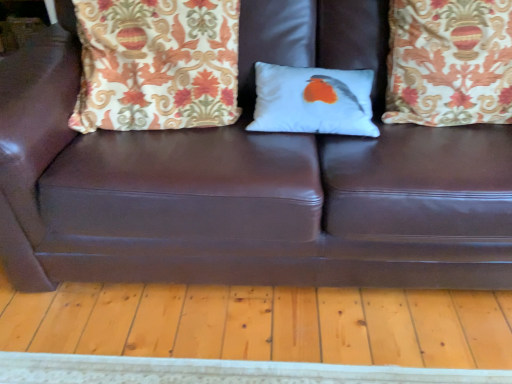
Question: Does patterned fabric pillow at upper left, placed as the 1th pillow when sorted from left to right, have a greater width compared to patterned fabric pillow at upper right, the first pillow when ordered from right to left?

Choices:
 (A) no
 (B) yes

Answer: (B)

Question: Is patterned fabric pillow at upper left, the third pillow positioned from the right, smaller than patterned fabric pillow at upper right, which appears as the third pillow when viewed from the left?

Choices:
 (A) yes
 (B) no

Answer: (B)

Question: Is patterned fabric pillow at upper left, placed as the 1th pillow when sorted from left to right, positioned behind patterned fabric pillow at upper right, which appears as the third pillow when viewed from the left?

Choices:
 (A) yes
 (B) no

Answer: (B)

Question: Would you say patterned fabric pillow at upper left, the third pillow positioned from the right, is a long distance from patterned fabric pillow at upper right, which appears as the third pillow when viewed from the left?

Choices:
 (A) no
 (B) yes

Answer: (A)

Question: Is patterned fabric pillow at upper left, placed as the 1th pillow when sorted from left to right, with patterned fabric pillow at upper right, the first pillow when ordered from right to left?

Choices:
 (A) no
 (B) yes

Answer: (A)

Question: From their relative heights in the image, would you say white matte pillow with bird design at center, which is the second pillow from right to left, is taller or shorter than patterned fabric pillow at upper left, the third pillow positioned from the right?

Choices:
 (A) short
 (B) tall

Answer: (A)

Question: In the image, is white matte pillow with bird design at center, which is the second pillow from right to left, positioned in front of or behind patterned fabric pillow at upper left, the third pillow positioned from the right?

Choices:
 (A) front
 (B) behind

Answer: (B)

Question: Visually, is white matte pillow with bird design at center, the 2th pillow positioned from the left, positioned to the left or to the right of patterned fabric pillow at upper left, placed as the 1th pillow when sorted from left to right?

Choices:
 (A) left
 (B) right

Answer: (B)

Question: From a real-world perspective, relative to patterned fabric pillow at upper left, placed as the 1th pillow when sorted from left to right, is white matte pillow with bird design at center, the 2th pillow positioned from the left, vertically above or below?

Choices:
 (A) below
 (B) above

Answer: (A)

Question: Is white matte pillow with bird design at center, which is the second pillow from right to left, wider or thinner than patterned fabric pillow at upper right, the first pillow when ordered from right to left?

Choices:
 (A) wide
 (B) thin

Answer: (B)

Question: Is white matte pillow with bird design at center, the 2th pillow positioned from the left, inside the boundaries of patterned fabric pillow at upper right, which appears as the third pillow when viewed from the left, or outside?

Choices:
 (A) inside
 (B) outside

Answer: (B)

Question: In terms of size, does white matte pillow with bird design at center, the 2th pillow positioned from the left, appear bigger or smaller than patterned fabric pillow at upper right, the first pillow when ordered from right to left?

Choices:
 (A) big
 (B) small

Answer: (B)

Question: From the image's perspective, relative to patterned fabric pillow at upper right, which appears as the third pillow when viewed from the left, is white matte pillow with bird design at center, which is the second pillow from right to left, above or below?

Choices:
 (A) below
 (B) above

Answer: (A)

Question: From a real-world perspective, is patterned fabric pillow at upper right, the first pillow when ordered from right to left, physically located above or below white matte pillow with bird design at center, the 2th pillow positioned from the left?

Choices:
 (A) above
 (B) below

Answer: (A)

Question: Relative to white matte pillow with bird design at center, which is the second pillow from right to left, is patterned fabric pillow at upper right, the first pillow when ordered from right to left, in front or behind?

Choices:
 (A) front
 (B) behind

Answer: (A)